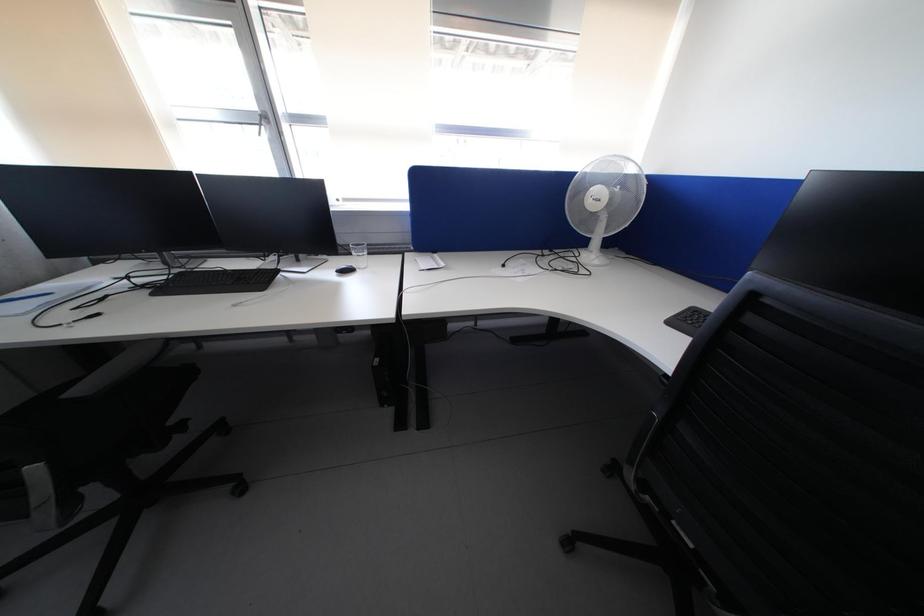
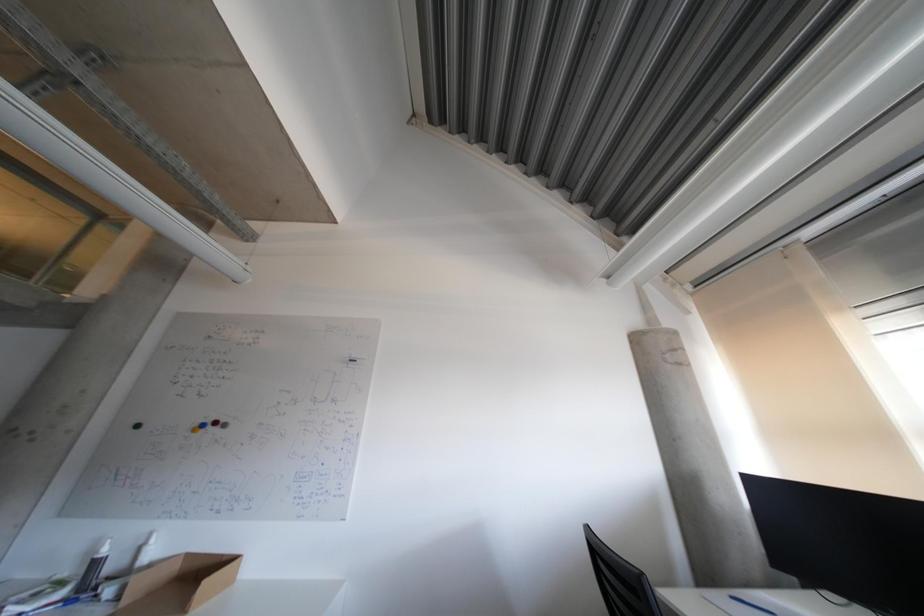
Based on the continuous images, in which direction is the camera rotating?

The camera rotated toward left-up.